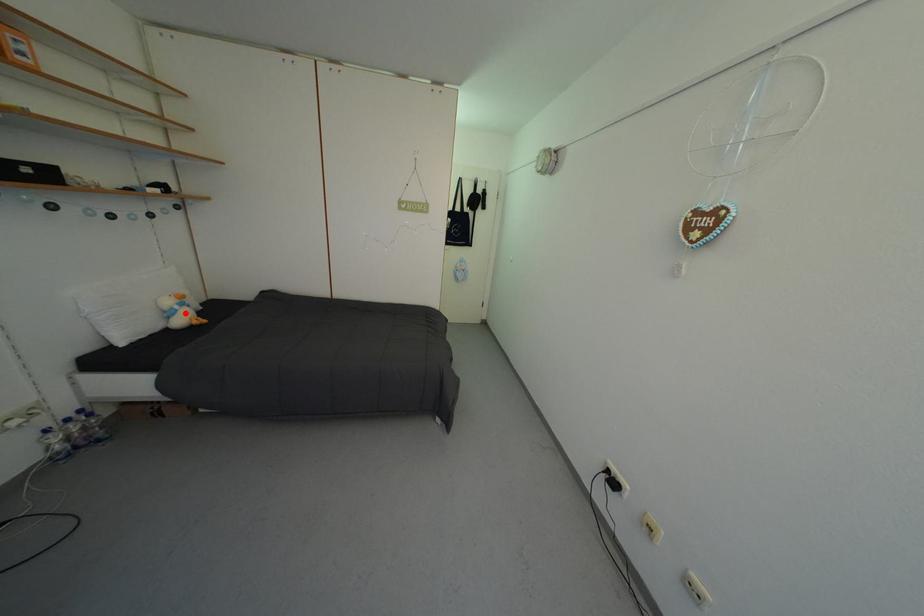
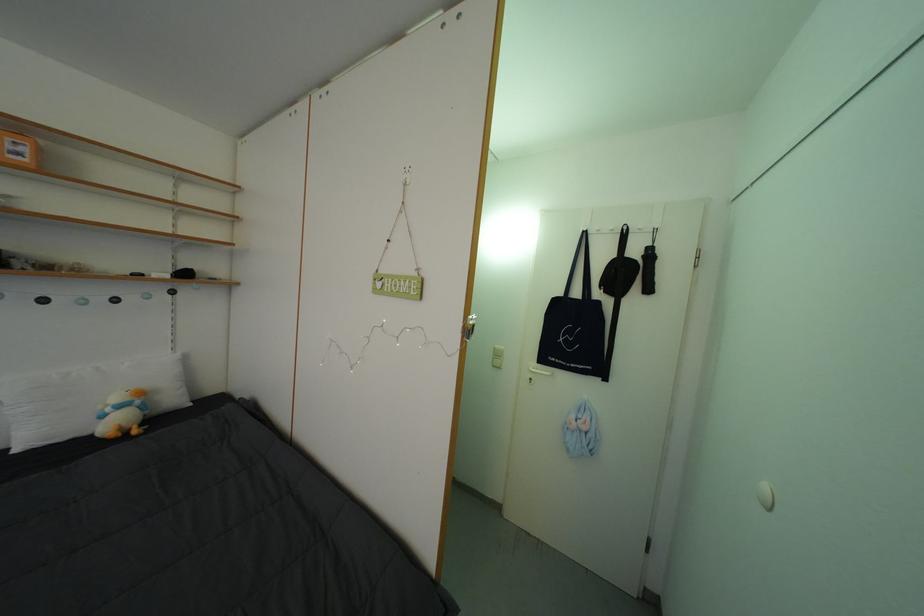
Question: I am providing you with two images of the same scene from different viewpoints. In image1, a red point is highlighted. Considering the same 3D point in image2, which of the following is correct?

Choices:
 (A) It is closer
 (B) It is farther

Answer: (A)